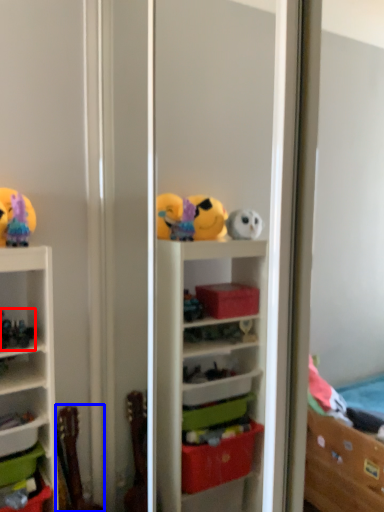
Question: Which object is closer to the camera taking this photo, toy (highlighted by a red box) or toy (highlighted by a blue box)?

Choices:
 (A) toy
 (B) toy

Answer: (A)